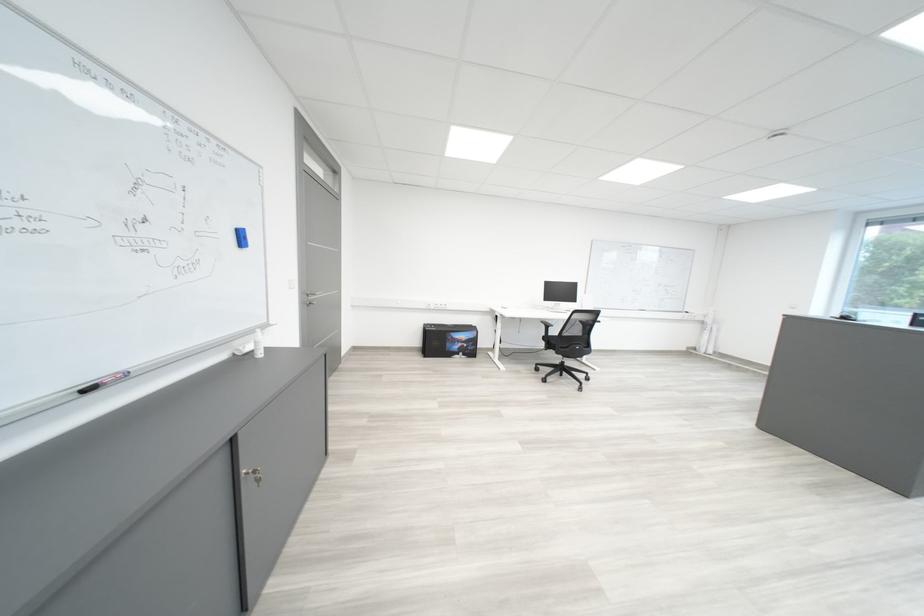
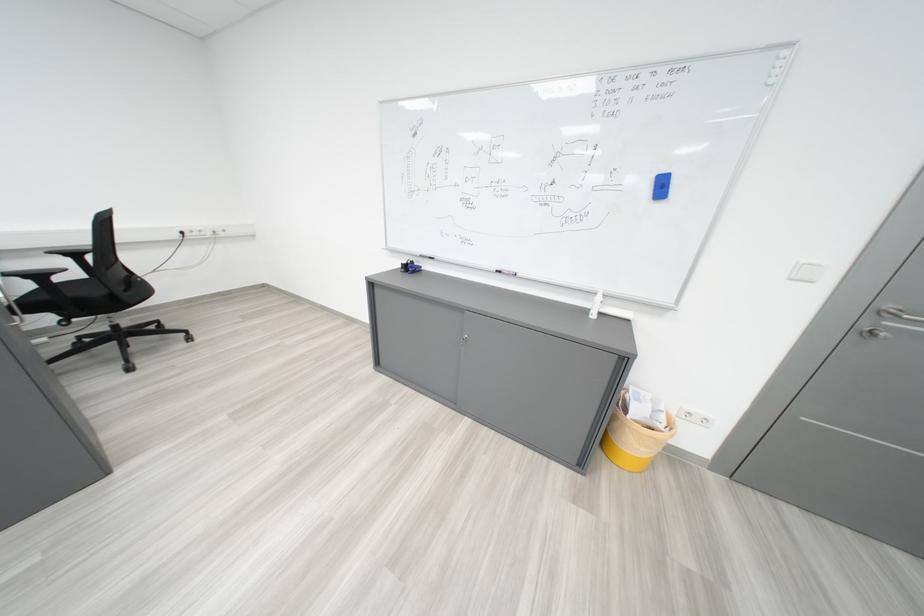
Where in the second image is the point corresponding to (x=100, y=392) from the first image?

(511, 273)